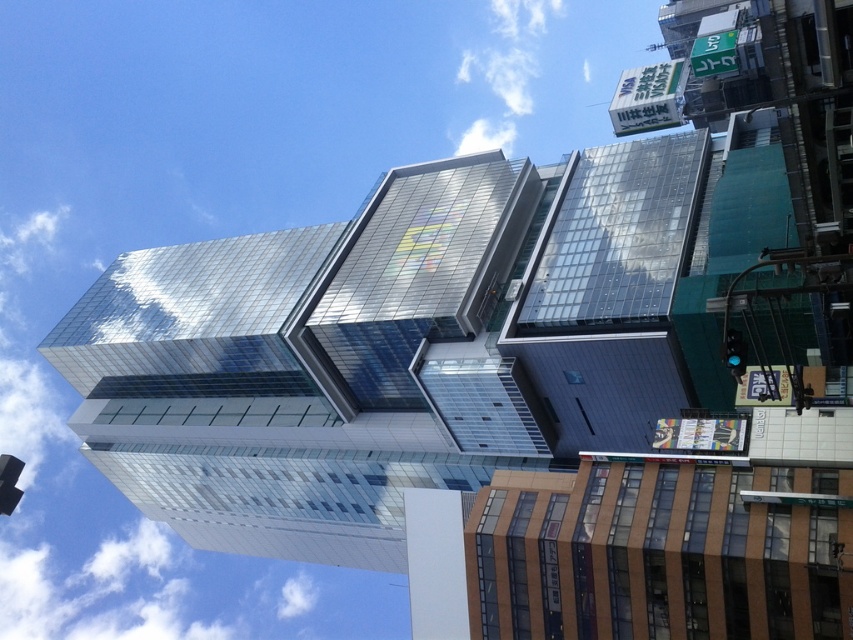
You are a city planner analyzing traffic lights in the urban area. You notice the black glass traffic light at lower left and the green glass traffic light at right. Which traffic light is taller?

The black glass traffic light at lower left is much taller than the green glass traffic light at right.

You are a city planner assessing the spacing between two traffic lights in a busy intersection. The black glass traffic light at lower left and the green glass traffic light at right are part of the new urban design. According to city regulations, traffic lights must be spaced at least 40 meters apart for optimal visibility. Does the current spacing between these two traffic lights meet the regulation requirements?

The black glass traffic light at lower left and the green glass traffic light at right are 41.39 meters apart, which exceeds the minimum required 40 meters. Therefore, the spacing between these two traffic lights meets the city regulation requirements.

You are a city planner analyzing traffic signals in the urban area. You observe the black glass traffic light at lower left and the green glass traffic light at right. Which traffic light is bigger in size?

The black glass traffic light at lower left has a larger size compared to the green glass traffic light at right, so the black glass traffic light at lower left is bigger.